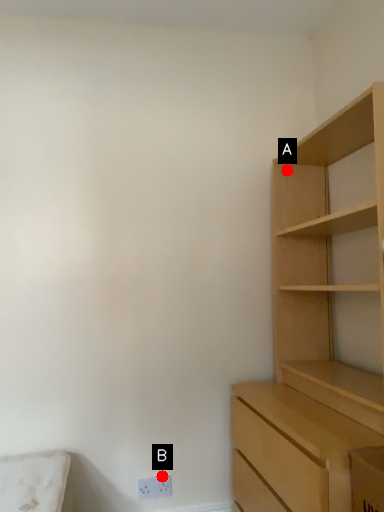
Question: Two points are circled on the image, labeled by A and B beside each circle. Which of the following is the closest to the observer?

Choices:
 (A) A is closer
 (B) B is closer

Answer: (B)